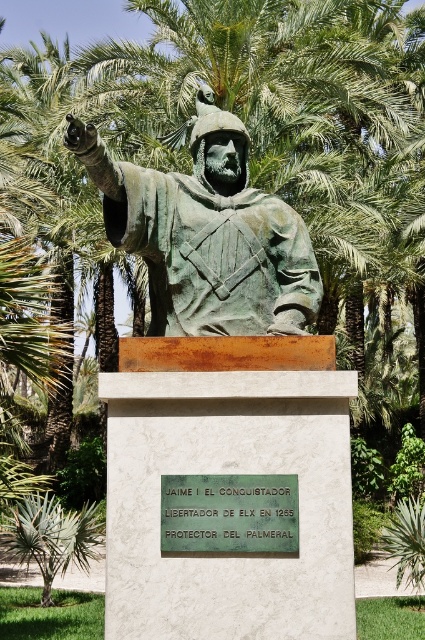
You are a park visitor standing at the entrance of the park. You see the bronze statue at center and the green leafy palm tree at lower left. Which object is closer to you?

The bronze statue at center is closer to you because it is positioned over the green leafy palm tree at lower left, indicating it is in front of it from your perspective.

You are a park visitor who wants to take a photo of the bronze statue at center without any obstructions. The green leafy palm tree at lower left is blocking your view. Based on their sizes, can you move to the side to get a clear shot?

The bronze statue at center is narrower than the green leafy palm tree at lower left, so moving to the side might not be enough to avoid the obstruction caused by the palm tree. Consider moving further back or adjusting your angle to ensure the statue is fully visible without the tree blocking it.